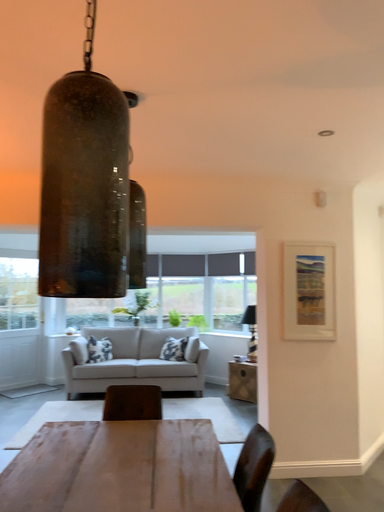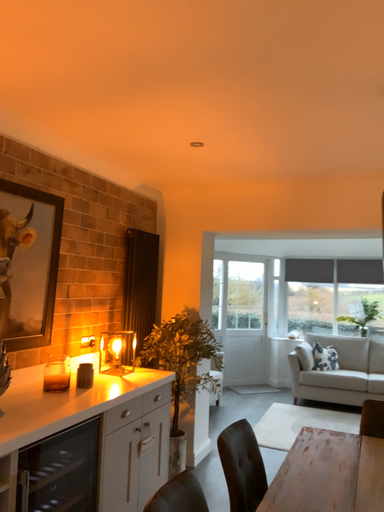
Question: How did the camera likely rotate when shooting the video?

Choices:
 (A) rotated right
 (B) rotated left

Answer: (B)